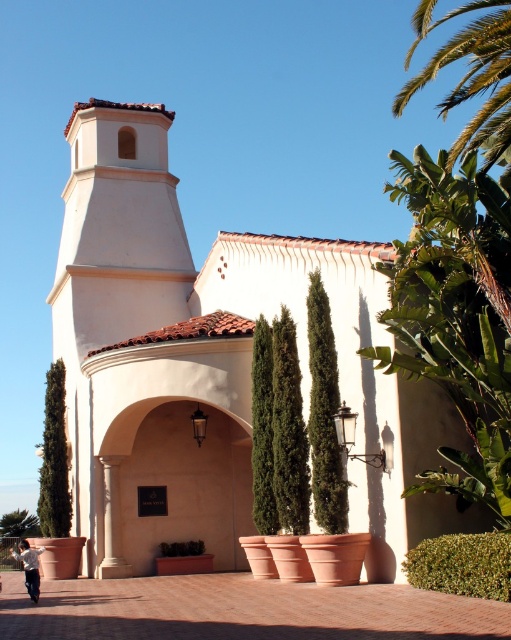
Question: Which object appears closest to the camera in this image?

Choices:
 (A) green leafy palm tree at upper right
 (B) green leafy bush at lower right
 (C) green textured bush at left
 (D) white stucco church at center

Answer: (B)

Question: Which point is farther to the camera?

Choices:
 (A) (30, 548)
 (B) (509, 554)
 (C) (357, 344)

Answer: (A)

Question: Considering the relative positions of white stucco church at center and green leafy bush at lower right in the image provided, where is white stucco church at center located with respect to green leafy bush at lower right?

Choices:
 (A) right
 (B) left

Answer: (B)

Question: Is white stucco church at center smaller than green leafy plant at center?

Choices:
 (A) yes
 (B) no

Answer: (B)

Question: Considering the relative positions of white stucco church at center and green leafy plant at center in the image provided, where is white stucco church at center located with respect to green leafy plant at center?

Choices:
 (A) above
 (B) below

Answer: (A)

Question: Which of the following is the farthest from the observer?

Choices:
 (A) (34, 556)
 (B) (174, 547)

Answer: (B)